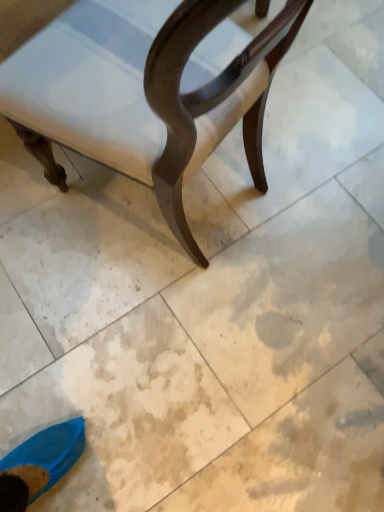
Image resolution: width=384 pixels, height=512 pixels. What are the coordinates of `vacant area located to the right-hand side of glossy wood chair at upper center` in the screenshot? It's located at (314, 181).